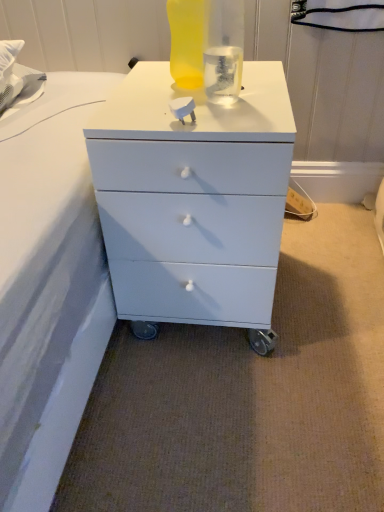
This screenshot has height=512, width=384. What do you see at coordinates (186, 42) in the screenshot? I see `translucent yellow bottle at upper center` at bounding box center [186, 42].

The image size is (384, 512). I want to click on translucent yellow bottle at upper center, so [x=186, y=42].

Measure the distance between point (134,143) and camera.

Point (134,143) is 29.84 inches away from camera.

Where is `white matte chest of drawers at center`? white matte chest of drawers at center is located at coordinates (194, 199).

The width and height of the screenshot is (384, 512). Describe the element at coordinates (194, 199) in the screenshot. I see `white matte chest of drawers at center` at that location.

Find the location of a particular element. The width and height of the screenshot is (384, 512). translucent yellow bottle at upper center is located at coordinates (186, 42).

Can you confirm if white matte chest of drawers at center is positioned to the right of translucent yellow bottle at upper center?

Indeed, white matte chest of drawers at center is positioned on the right side of translucent yellow bottle at upper center.

Between white matte chest of drawers at center and translucent yellow bottle at upper center, which one is positioned in front?

Positioned in front is white matte chest of drawers at center.

Looking at this image, which is farther from the camera, (284,176) or (182,23)?

Positioned behind is point (182,23).

From the image's perspective, would you say white matte chest of drawers at center is positioned over translucent yellow bottle at upper center?

No, from the image's perspective, white matte chest of drawers at center is not on top of translucent yellow bottle at upper center.

From a real-world perspective, which object rests below the other?

white matte chest of drawers at center.

Does white matte chest of drawers at center have a greater width compared to translucent yellow bottle at upper center?

Correct, the width of white matte chest of drawers at center exceeds that of translucent yellow bottle at upper center.

Considering the sizes of white matte chest of drawers at center and translucent yellow bottle at upper center in the image, is white matte chest of drawers at center taller or shorter than translucent yellow bottle at upper center?

In the image, white matte chest of drawers at center appears to be taller than translucent yellow bottle at upper center.

Who is smaller, white matte chest of drawers at center or translucent yellow bottle at upper center?

translucent yellow bottle at upper center is smaller.

From the picture: Is translucent yellow bottle at upper center a part of white matte chest of drawers at center?

That's incorrect, translucent yellow bottle at upper center is not inside white matte chest of drawers at center.

Are white matte chest of drawers at center and translucent yellow bottle at upper center far apart?

No, white matte chest of drawers at center is not far away from translucent yellow bottle at upper center.

Is white matte chest of drawers at center oriented away from translucent yellow bottle at upper center?

No, white matte chest of drawers at center is not facing away from translucent yellow bottle at upper center.

Can you tell me how much white matte chest of drawers at center and translucent yellow bottle at upper center differ in facing direction?

white matte chest of drawers at center and translucent yellow bottle at upper center are facing 0.00022 degrees away from each other.

Locate an element on the screen. This screenshot has height=512, width=384. chest of drawers in front of the translucent yellow bottle at upper center is located at coordinates (194, 199).

Does translucent yellow bottle at upper center appear on the right side of white matte chest of drawers at center?

No, translucent yellow bottle at upper center is not to the right of white matte chest of drawers at center.

In the scene shown: Who is more distant, translucent yellow bottle at upper center or white matte chest of drawers at center?

translucent yellow bottle at upper center.

Considering the points (189, 84) and (249, 141), which point is in front, point (189, 84) or point (249, 141)?

Point (249, 141)

From the picture: From the image's perspective, which is below, translucent yellow bottle at upper center or white matte chest of drawers at center?

white matte chest of drawers at center is shown below in the image.

From a real-world perspective, between translucent yellow bottle at upper center and white matte chest of drawers at center, who is vertically lower?

From a 3D spatial view, white matte chest of drawers at center is below.

Based on the photo, is translucent yellow bottle at upper center thinner than white matte chest of drawers at center?

Indeed, translucent yellow bottle at upper center has a lesser width compared to white matte chest of drawers at center.

Is translucent yellow bottle at upper center taller or shorter than white matte chest of drawers at center?

Clearly, translucent yellow bottle at upper center is shorter compared to white matte chest of drawers at center.

Can you confirm if translucent yellow bottle at upper center is bigger than white matte chest of drawers at center?

No, translucent yellow bottle at upper center is not bigger than white matte chest of drawers at center.

Based on the photo, is translucent yellow bottle at upper center situated inside white matte chest of drawers at center or outside?

translucent yellow bottle at upper center is spatially situated outside white matte chest of drawers at center.

Are translucent yellow bottle at upper center and white matte chest of drawers at center beside each other?

No, translucent yellow bottle at upper center is not making contact with white matte chest of drawers at center.

Looking at this image, is translucent yellow bottle at upper center facing away from white matte chest of drawers at center?

No, translucent yellow bottle at upper center is not facing away from white matte chest of drawers at center.

What's the angular difference between translucent yellow bottle at upper center and white matte chest of drawers at center's facing directions?

The facing directions of translucent yellow bottle at upper center and white matte chest of drawers at center are 0.00022 degrees apart.

How far apart are translucent yellow bottle at upper center and white matte chest of drawers at center?

translucent yellow bottle at upper center is 11.35 inches away from white matte chest of drawers at center.

Identify the location of chest of drawers that appears on the right of translucent yellow bottle at upper center. This screenshot has width=384, height=512. (194, 199).

Identify the location of bottle that appears behind the white matte chest of drawers at center. This screenshot has width=384, height=512. (186, 42).

This screenshot has width=384, height=512. Find the location of `bottle located above the white matte chest of drawers at center (from a real-world perspective)`. bottle located above the white matte chest of drawers at center (from a real-world perspective) is located at coordinates (186, 42).